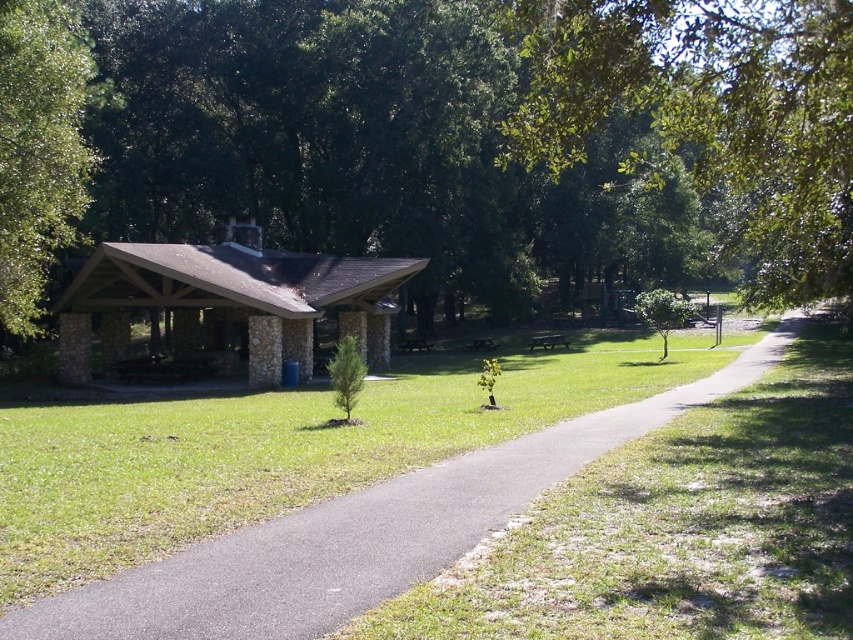
You are planning to set up a picnic blanket in the park. You see the asphalt at center and the metallic silver picnic table at center. Which surface would you choose to place your blanket, and why?

You should place your picnic blanket on the metallic silver picnic table at center because the asphalt at center is positioned to its left, meaning the picnic table is to the right of the asphalt. Since the picnic table is likely designed for seating and has a flat surface, it would be more suitable for placing a blanket compared to the asphalt, which is a road surface.